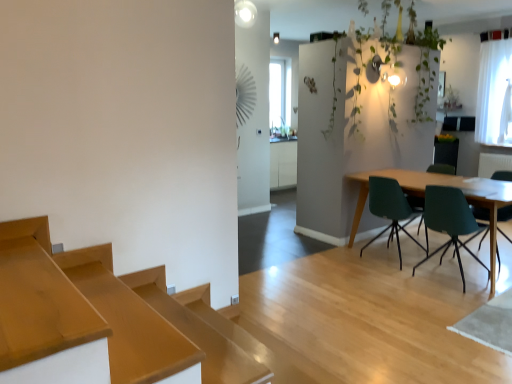
Question: From the image's perspective, is wooden table at right located above or below green matte chair at right, the first chair in the right-to-left sequence?

Choices:
 (A) below
 (B) above

Answer: (A)

Question: Is point (463, 187) positioned closer to the camera than point (509, 178)?

Choices:
 (A) farther
 (B) closer

Answer: (B)

Question: Which is nearer to the wooden table at right?

Choices:
 (A) teal plastic chair at center right, which is the fourth chair from right to left
 (B) green leafy plant at upper right
 (C) green matte chair at right, the fourth chair in the left-to-right sequence
 (D) green matte chair at right, marked as the second chair in a right-to-left arrangement
 (E) matte green chair at right, arranged as the second chair when viewed from the left

Answer: (E)

Question: Estimate the real-world distances between objects in this image. Which object is farther from the teal plastic chair at center right, which is the fourth chair from right to left?

Choices:
 (A) matte green chair at right, marked as the 3th chair in a right-to-left arrangement
 (B) green matte chair at right, the 3th chair when ordered from left to right
 (C) white sheer curtain at upper right
 (D) green matte chair at right, the fourth chair in the left-to-right sequence
 (E) green leafy plant at upper right

Answer: (C)